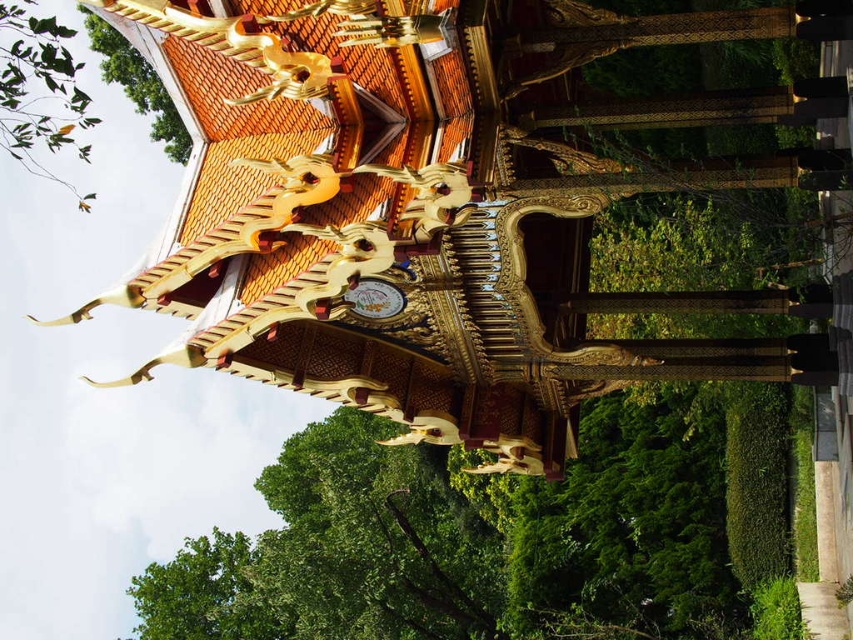
You are standing in front of the traditional Thai pavilion and notice a green leafy tree at upper left and a gold metallic clock at center. Which object is closer to you?

The green leafy tree at upper left is closer to you because it is further to the viewer than the gold metallic clock at center.

You are standing in front of the pavilion and notice a green leafy tree at upper left and a gold metallic clock at center. Which object is positioned higher in the scene?

The green leafy tree at upper left is positioned higher than the gold metallic clock at center.

You are standing 100 feet away from the traditional Thai pavilion. You notice a green leafy branch at upper left near the roof. Can you reach the branch with a 100 feet long pole?

The green leafy branch at upper left is 104.45 feet away from the viewer. Since the pole is 100 feet long, it is shorter than the distance required, so you cannot reach the branch with the pole.